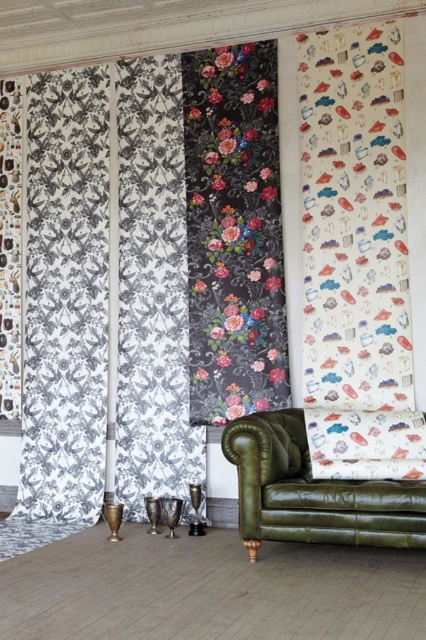
Based on the photo, is floral fabric at center above olive green leather armchair at lower right?

Indeed, floral fabric at center is positioned over olive green leather armchair at lower right.

Does floral fabric at center have a greater height compared to olive green leather armchair at lower right?

Yes, floral fabric at center is taller than olive green leather armchair at lower right.

Measure the distance between point (207, 96) and camera.

Point (207, 96) is 5.99 meters away from camera.

Image resolution: width=426 pixels, height=640 pixels. In order to click on floral fabric at center in this screenshot , I will do `click(233, 232)`.

Which is more to the right, black and white patterned fabric at left or floral fabric at center?

floral fabric at center

Locate an element on the screen. This screenshot has width=426, height=640. black and white patterned fabric at left is located at coordinates (106, 292).

Between point (333, 51) and point (255, 356), which one is positioned in front?

Positioned in front is point (333, 51).

Is white paper with colorful illustrations at right in front of floral fabric at center?

Yes, it is.

At what (x,y) coordinates should I click in order to perform the action: click on white paper with colorful illustrations at right. Please return your answer as a coordinate pair (x, y). The image size is (426, 640). Looking at the image, I should click on (356, 257).